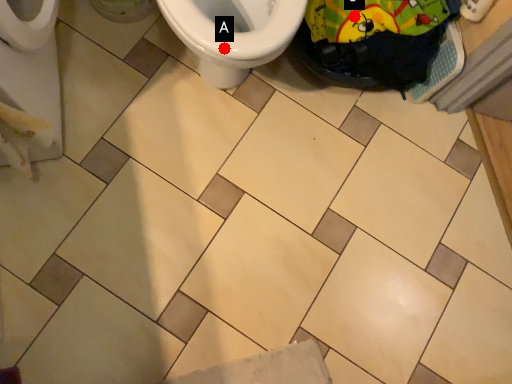
Question: Two points are circled on the image, labeled by A and B beside each circle. Which of the following is the closest to the observer?

Choices:
 (A) A is closer
 (B) B is closer

Answer: (A)